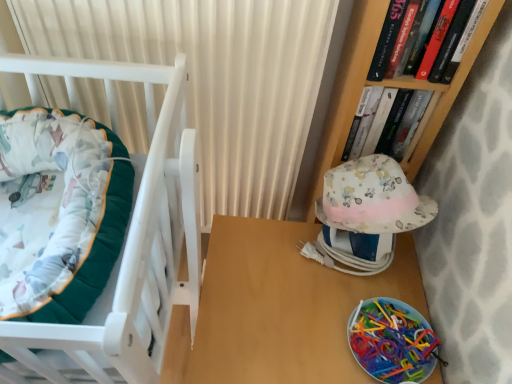
Identify the location of free spot in front of fluffy cotton hat at right. (316, 318).